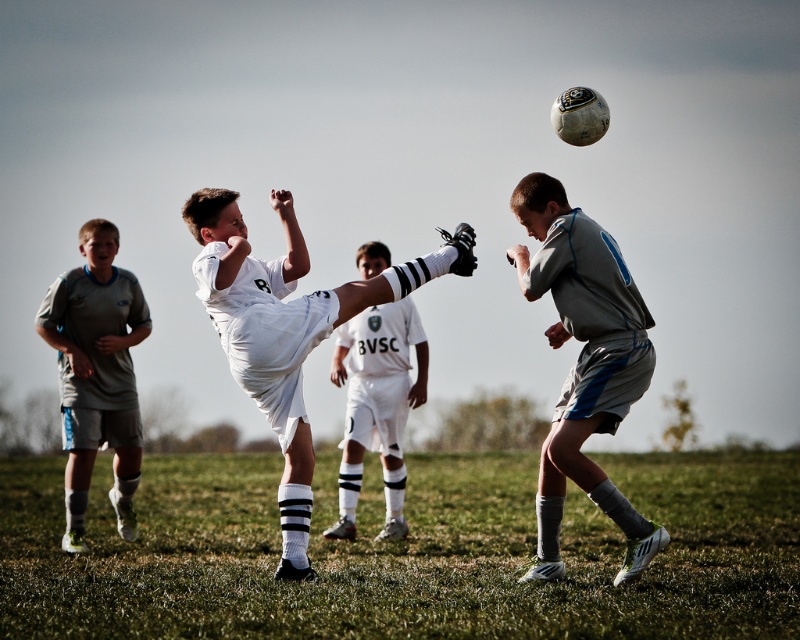
What are the coordinates of `gray fabric shorts at right` in the screenshot? It's located at (584, 362).

At what (x,y) coordinates should I click in order to perform the action: click on gray fabric shorts at right. Please return your answer as a coordinate pair (x, y). This screenshot has height=640, width=800. Looking at the image, I should click on (584, 362).

Does white matte soccer player at center lie behind gray matte shorts at left?

No.

Does white matte soccer player at center appear under gray matte shorts at left?

No.

Which is in front, point (454, 253) or point (84, 266)?

Point (454, 253) is more forward.

Where is `white matte soccer player at center`? white matte soccer player at center is located at coordinates pos(286,330).

Between point (224, 202) and point (342, 509), which one is positioned in front?

Point (224, 202) is in front.

Who is more forward, (562, 97) or (404, 301)?

Point (562, 97) is more forward.

You are a GUI agent. You are given a task and a screenshot of the screen. Output one action in this format:
    pyautogui.click(x=<x>, y=<y>)
    Task: Click on the white matte soccer ball at upper center
    
    Given the screenshot: What is the action you would take?
    pyautogui.click(x=584, y=364)